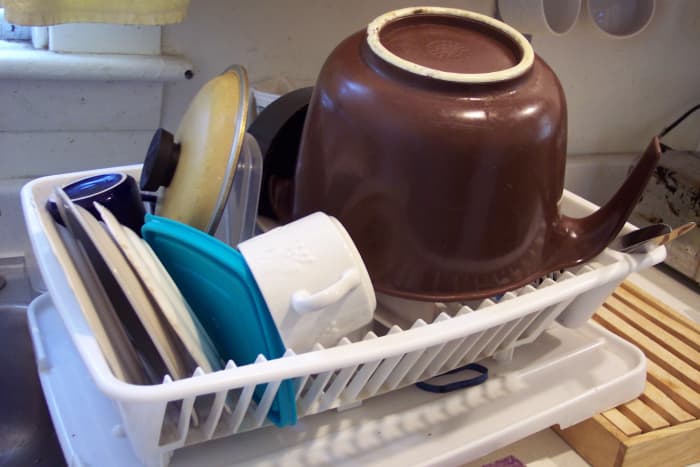
Identify the location of countertop underneath the drying rack. (554, 452).